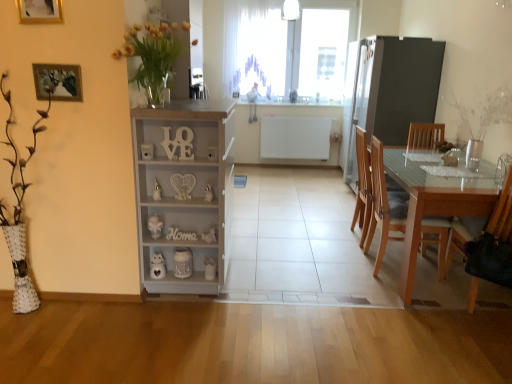
Question: Can you confirm if transparent glass table at right is bigger than yellow glass vase at upper left?

Choices:
 (A) yes
 (B) no

Answer: (A)

Question: Is transparent glass table at right far from yellow glass vase at upper left?

Choices:
 (A) yes
 (B) no

Answer: (A)

Question: Does transparent glass table at right appear on the right side of yellow glass vase at upper left?

Choices:
 (A) no
 (B) yes

Answer: (B)

Question: From the image's perspective, is transparent glass table at right located beneath yellow glass vase at upper left?

Choices:
 (A) no
 (B) yes

Answer: (B)

Question: Is transparent glass table at right touching yellow glass vase at upper left?

Choices:
 (A) no
 (B) yes

Answer: (A)

Question: Based on their positions, is white painted wood cabinet at center located to the left or right of yellow glass vase at upper left?

Choices:
 (A) left
 (B) right

Answer: (B)

Question: Is white painted wood cabinet at center inside the boundaries of yellow glass vase at upper left, or outside?

Choices:
 (A) inside
 (B) outside

Answer: (B)

Question: Is point (163, 132) positioned closer to the camera than point (159, 97)?

Choices:
 (A) closer
 (B) farther

Answer: (A)

Question: From the image's perspective, is white painted wood cabinet at center located above or below yellow glass vase at upper left?

Choices:
 (A) below
 (B) above

Answer: (A)

Question: From the image's perspective, is transparent glass table at right positioned above or below light brown wood chair at right, acting as the 2th chair starting from the front?

Choices:
 (A) above
 (B) below

Answer: (B)

Question: In the image, is transparent glass table at right positioned in front of or behind light brown wood chair at right, acting as the 2th chair starting from the front?

Choices:
 (A) front
 (B) behind

Answer: (A)

Question: From their relative heights in the image, would you say transparent glass table at right is taller or shorter than light brown wood chair at right, the second chair viewed from the back?

Choices:
 (A) tall
 (B) short

Answer: (B)

Question: Considering the positions of transparent glass table at right and light brown wood chair at right, the second chair viewed from the back, in the image, is transparent glass table at right bigger or smaller than light brown wood chair at right, the second chair viewed from the back,?

Choices:
 (A) small
 (B) big

Answer: (B)

Question: Is gold wooden picture frame at upper left, acting as the 1th picture frame starting from the top, wider or thinner than white matte radiator at center, acting as the 1th appliance starting from the left?

Choices:
 (A) thin
 (B) wide

Answer: (A)

Question: Is gold wooden picture frame at upper left, which is the 2th picture frame from bottom to top, to the left or to the right of white matte radiator at center, acting as the 1th appliance starting from the left, in the image?

Choices:
 (A) right
 (B) left

Answer: (B)